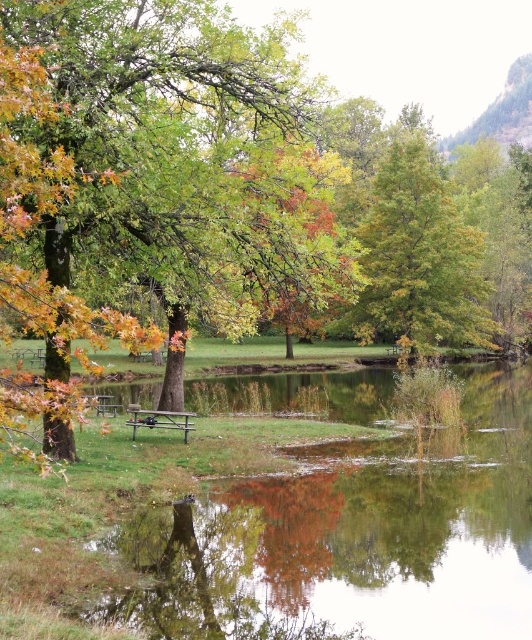
How distant is green leafy tree at center from wooden park bench at center?

green leafy tree at center is 8.61 meters away from wooden park bench at center.

Is green leafy tree at center further to the viewer compared to wooden park bench at center?

No, it is in front of wooden park bench at center.

Is point (292, 38) positioned after point (88, 397)?

That is False.

This screenshot has height=640, width=532. I want to click on green leafy tree at center, so click(x=168, y=179).

Does point (73, 184) come in front of point (133, 404)?

Yes, it is.

Does point (254, 35) lie behind point (148, 416)?

That is False.

Between point (269, 86) and point (170, 422), which one is positioned in front?

Point (269, 86) is in front.

Where is `green leafy tree at center`? Image resolution: width=532 pixels, height=640 pixels. green leafy tree at center is located at coordinates (168, 179).

Can you confirm if green leafy tree at center is wider than green matte tree at center?

No.

Looking at this image, how distant is green leafy tree at center from green matte tree at center?

The distance of green leafy tree at center from green matte tree at center is 16.64 meters.

Which is behind, point (87, 49) or point (469, 225)?

Positioned behind is point (469, 225).

Where is `green leafy tree at center`? green leafy tree at center is located at coordinates (168, 179).